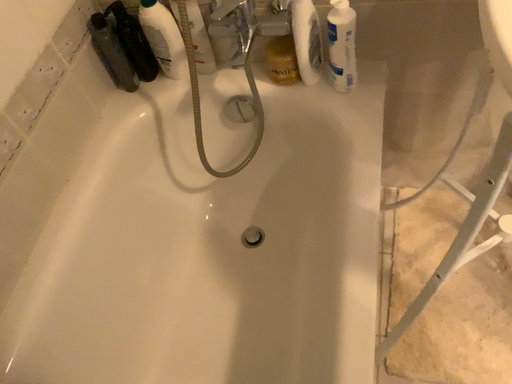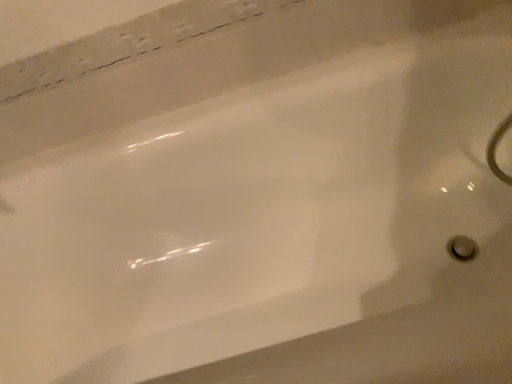
Question: How did the camera likely rotate when shooting the video?

Choices:
 (A) rotated left
 (B) rotated right

Answer: (A)